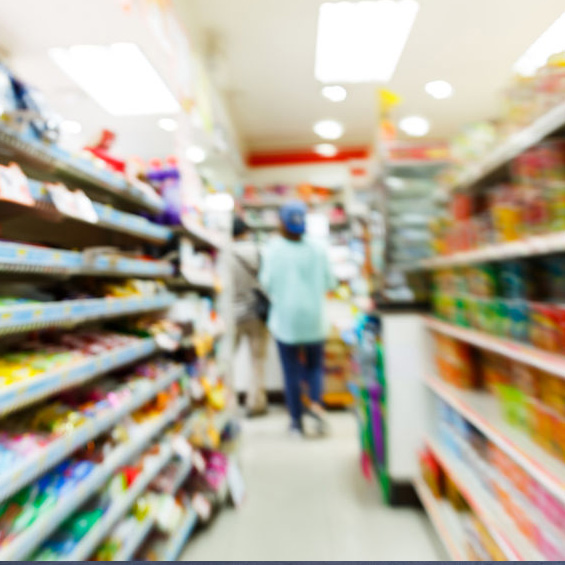
Find the location of a particular element. This screenshot has height=565, width=565. floor is located at coordinates (290, 480).